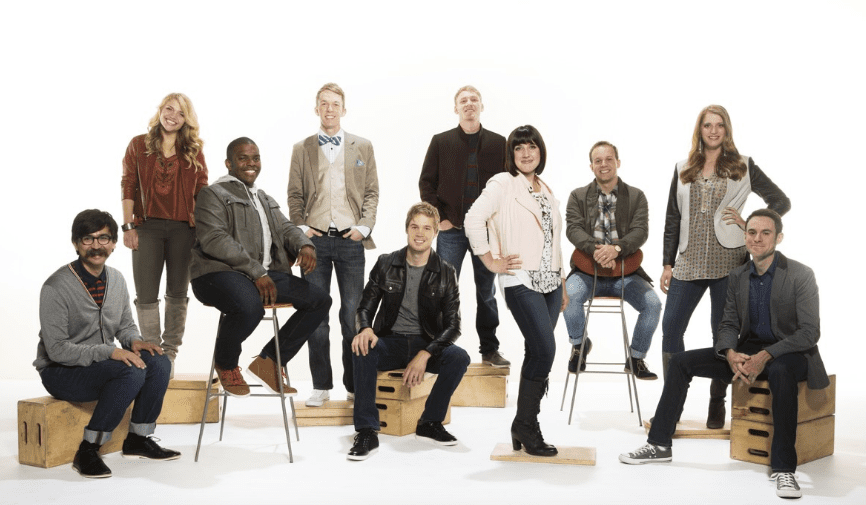
At what (x,y) coordinates should I click in order to perform the action: click on boxes. Please return your answer as a coordinate pair (x, y). Image resolution: width=866 pixels, height=505 pixels. Looking at the image, I should click on (185, 400), (54, 434), (395, 416), (392, 390), (391, 370), (494, 390), (583, 454), (759, 396), (757, 438).